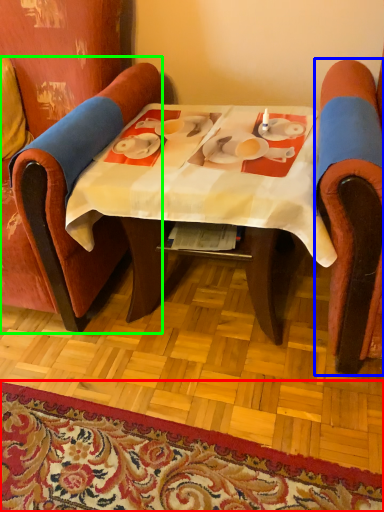
Question: Estimate the real-world distances between objects in this image. Which object is closer to mat (highlighted by a red box), chair (highlighted by a blue box) or chair (highlighted by a green box)?

Choices:
 (A) chair
 (B) chair

Answer: (B)